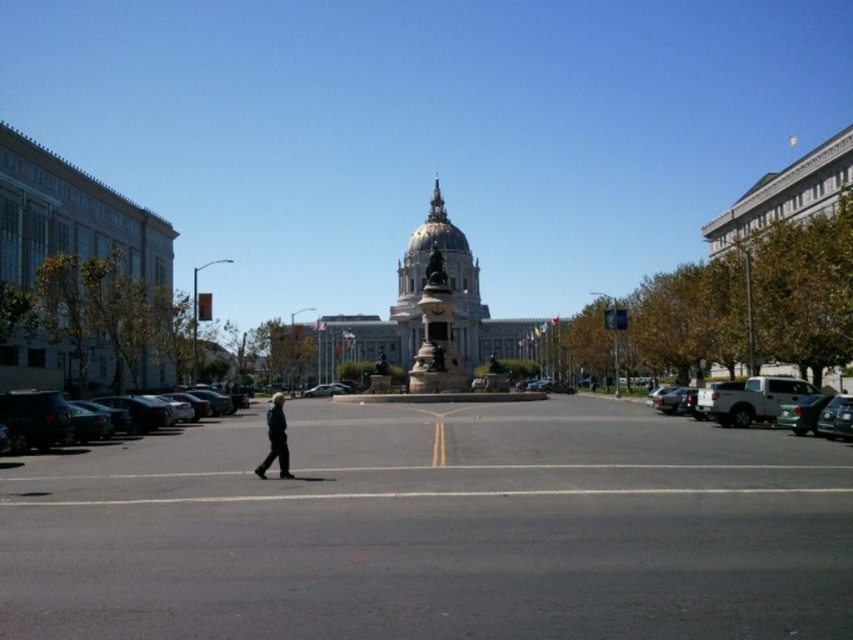
Question: Estimate the real-world distances between objects in this image. Which object is closer to the metallic silver sedan at center?

Choices:
 (A) dark blue jacket at center
 (B) dark green matte car at left

Answer: (A)

Question: Observing the image, what is the correct spatial positioning of dark green matte car at left in reference to metallic silver sedan at center?

Choices:
 (A) right
 (B) left

Answer: (B)

Question: Which is nearer to the gold textured spire at center?

Choices:
 (A) metallic silver sedan at center
 (B) dark blue jacket at center
 (C) dark green matte car at left

Answer: (A)

Question: Which object is closer to the camera taking this photo?

Choices:
 (A) gold textured spire at center
 (B) dark green matte car at left
 (C) metallic silver sedan at center

Answer: (B)

Question: Does dark blue jacket at center appear on the right side of gold textured spire at center?

Choices:
 (A) yes
 (B) no

Answer: (B)

Question: Is dark green matte car at left wider than dark blue jacket at center?

Choices:
 (A) no
 (B) yes

Answer: (A)